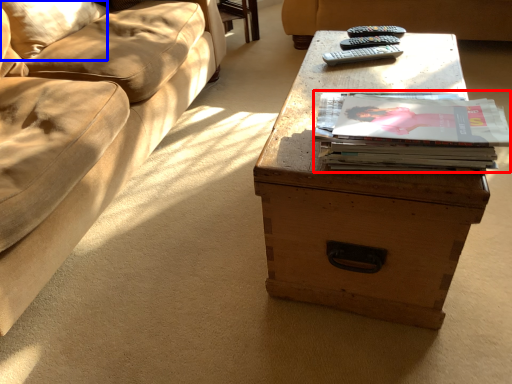
Question: Among these objects, which one is farthest to the camera, paperback book (highlighted by a red box) or pillow (highlighted by a blue box)?

Choices:
 (A) paperback book
 (B) pillow

Answer: (B)